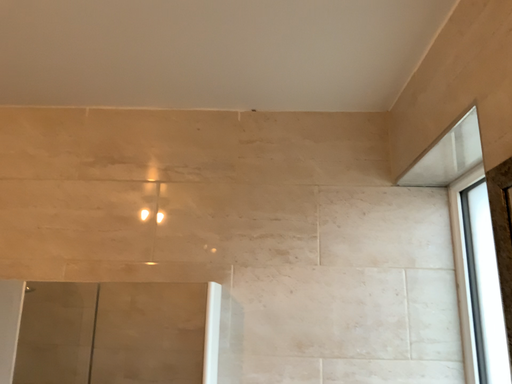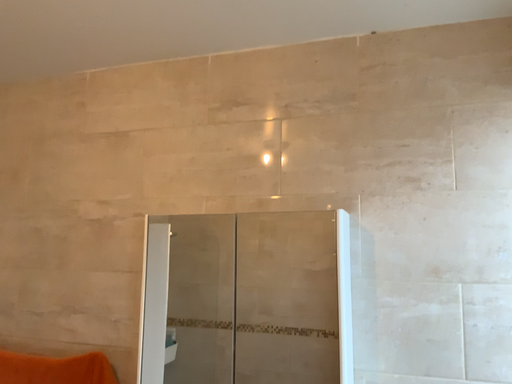
Question: Which way did the camera rotate in the video?

Choices:
 (A) rotated downward
 (B) rotated upward

Answer: (A)